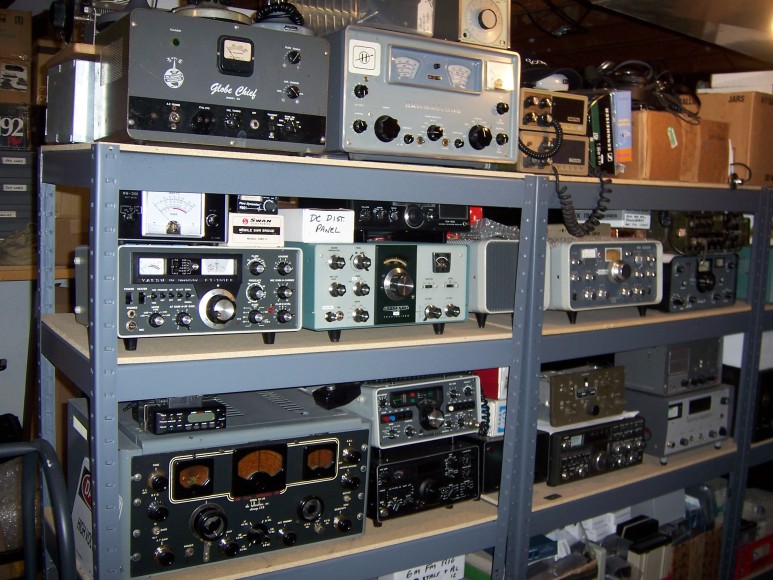
The height and width of the screenshot is (580, 773). Identify the location of ceiling. (716, 5).